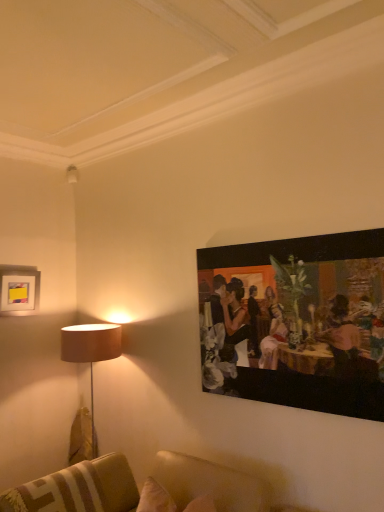
Question: Visually, is matte white picture frame at upper left, the 2th picture frame in the right-to-left sequence, positioned to the left or to the right of oil painting at upper right, which is the 2th picture frame in back-to-front order?

Choices:
 (A) left
 (B) right

Answer: (A)

Question: Is matte white picture frame at upper left, which ranks as the 2th picture frame in front-to-back order, inside the boundaries of oil painting at upper right, which is the 2th picture frame in back-to-front order, or outside?

Choices:
 (A) outside
 (B) inside

Answer: (A)

Question: Which object is positioned closest to the oil painting at upper right, which is the 2th picture frame in left-to-right order?

Choices:
 (A) matte white picture frame at upper left, which is the first picture frame in left-to-right order
 (B) leather couch at lower center

Answer: (B)

Question: Considering the real-world distances, which object is closest to the leather couch at lower center?

Choices:
 (A) oil painting at upper right, the first picture frame when ordered from front to back
 (B) matte white picture frame at upper left, which ranks as the 2th picture frame in front-to-back order

Answer: (A)